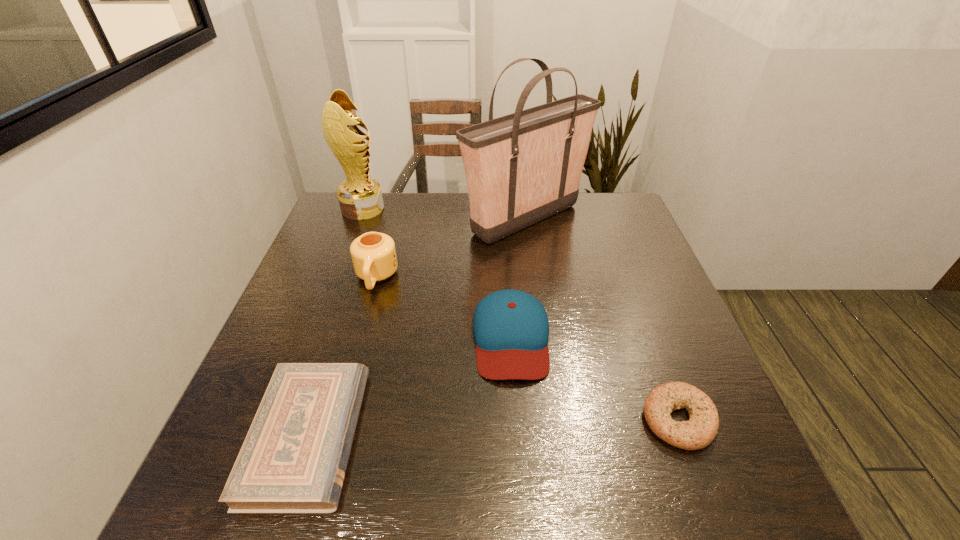
Identify the location of bagel present at the right edge. (697, 433).

Identify the location of object at the far left corner. (360, 197).

Identify the location of object that is at the near left corner. (293, 460).

This screenshot has width=960, height=540. Identify the location of object present at the far right corner. (522, 168).

The height and width of the screenshot is (540, 960). What are the coordinates of `free space at the far edge` in the screenshot? It's located at (447, 213).

Identify the location of free space at the left edge of the desktop. (343, 242).

Where is `free space at the right edge`? The image size is (960, 540). free space at the right edge is located at coordinates (631, 241).

Locate an element on the screen. The height and width of the screenshot is (540, 960). free region at the far left corner is located at coordinates (329, 218).

In the image, there is a desktop. Find the location of `free space at the far right corner`. free space at the far right corner is located at coordinates (618, 211).

Identify the location of vacant area at the near right corner. The height and width of the screenshot is (540, 960). [678, 502].